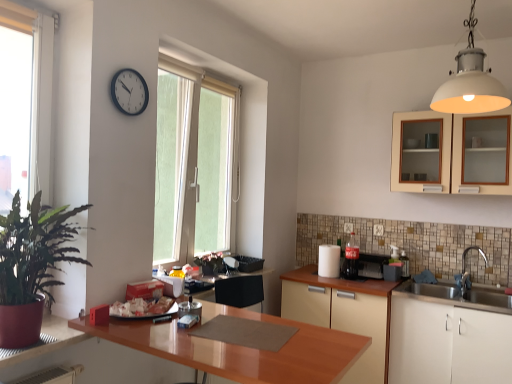
Question: Is green frosted glass window at center, which is counted as the 1th window, starting from the right, to the right of white matte cabinet at lower right, the third cabinetry when ordered from top to bottom, from the viewer's perspective?

Choices:
 (A) yes
 (B) no

Answer: (B)

Question: From a real-world perspective, is green frosted glass window at center, arranged as the second window when viewed from the left, below white matte cabinet at lower right, the third cabinetry when ordered from top to bottom?

Choices:
 (A) no
 (B) yes

Answer: (A)

Question: Is green frosted glass window at center, the first window from the back, aimed at white matte cabinet at lower right, arranged as the 1th cabinetry when ordered from the bottom?

Choices:
 (A) no
 (B) yes

Answer: (B)

Question: Is green frosted glass window at center, which is counted as the 1th window, starting from the right, outside of white matte cabinet at lower right, the third cabinetry when ordered from top to bottom?

Choices:
 (A) yes
 (B) no

Answer: (A)

Question: Does green frosted glass window at center, arranged as the second window when viewed from the left, have a lesser height compared to white matte cabinet at lower right, the third cabinetry when ordered from top to bottom?

Choices:
 (A) yes
 (B) no

Answer: (B)

Question: Does green frosted glass window at center, which is the second window from front to back, lie in front of white matte cabinet at lower right, arranged as the 1th cabinetry when ordered from the bottom?

Choices:
 (A) no
 (B) yes

Answer: (A)

Question: Would you say black plastic clock at upper center is outside matte cream cabinet at upper right, which is the 3th cabinetry from bottom to top?

Choices:
 (A) yes
 (B) no

Answer: (A)

Question: Is black plastic clock at upper center to the right of matte cream cabinet at upper right, which is the 3th cabinetry from bottom to top, from the viewer's perspective?

Choices:
 (A) yes
 (B) no

Answer: (B)

Question: Is black plastic clock at upper center oriented away from matte cream cabinet at upper right, the 1th cabinetry viewed from the top?

Choices:
 (A) no
 (B) yes

Answer: (A)

Question: Is black plastic clock at upper center facing towards matte cream cabinet at upper right, which is the 3th cabinetry from bottom to top?

Choices:
 (A) no
 (B) yes

Answer: (A)

Question: Is black plastic clock at upper center to the left of matte cream cabinet at upper right, which is the 3th cabinetry from bottom to top, from the viewer's perspective?

Choices:
 (A) no
 (B) yes

Answer: (B)

Question: From the image's perspective, does black plastic clock at upper center appear lower than matte cream cabinet at upper right, which is the 3th cabinetry from bottom to top?

Choices:
 (A) no
 (B) yes

Answer: (A)

Question: Is green frosted glass window at center, which is the second window from front to back, at the back of white matte light fixture at upper right?

Choices:
 (A) yes
 (B) no

Answer: (A)